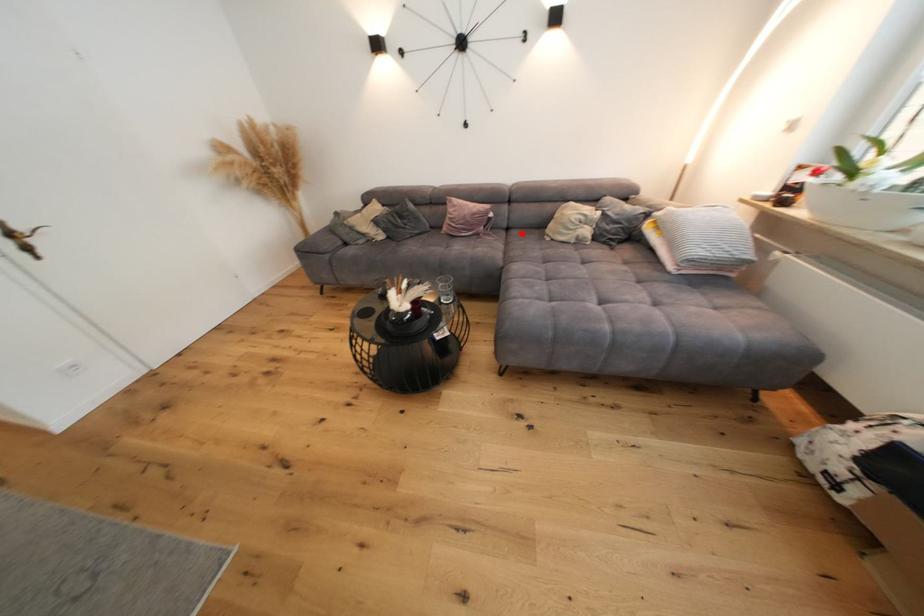
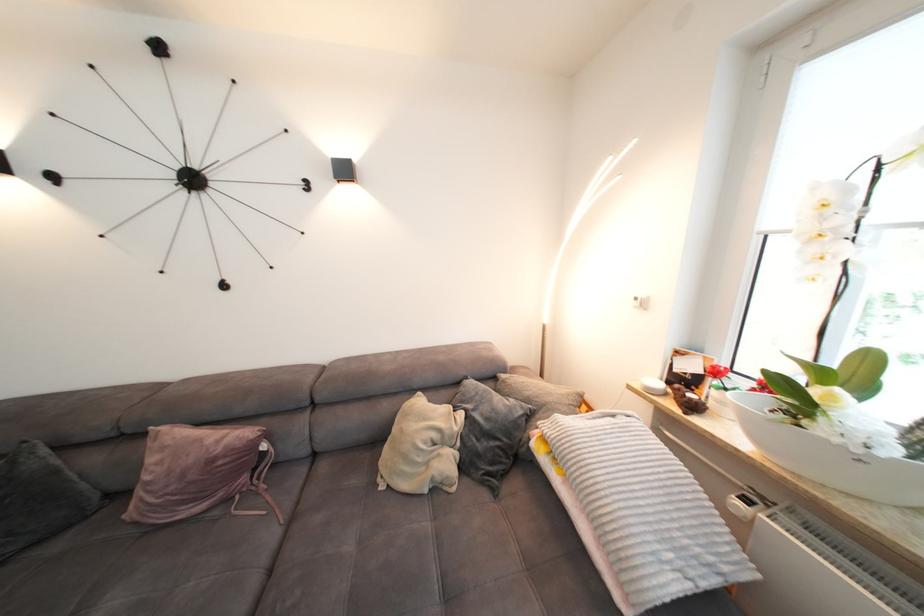
Find the pixel in the second image that matches the highlighted location in the first image.

(330, 469)